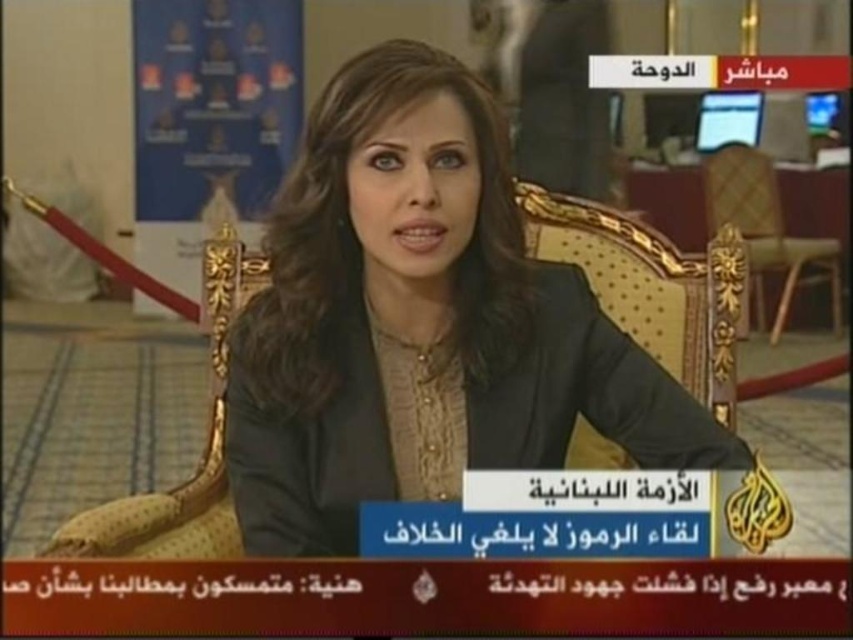
The image size is (853, 640). What do you see at coordinates (421, 323) in the screenshot? I see `matte black suit at center` at bounding box center [421, 323].

Is point (358, 492) behind point (717, 205)?

No, it is not.

Who is more forward, (502, 148) or (830, 305)?

Point (502, 148) is in front.

The height and width of the screenshot is (640, 853). I want to click on matte black suit at center, so click(x=421, y=323).